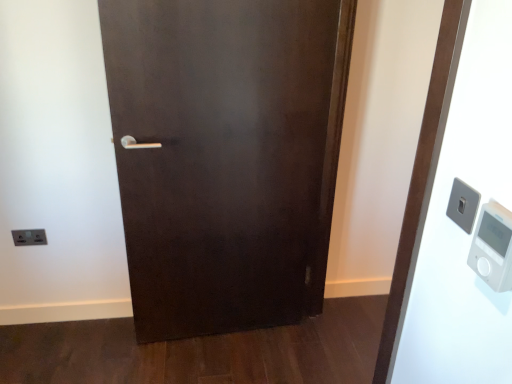
Question: From the image's perspective, is white plastic elevator at right positioned above or below satin silver switch at upper right, acting as the 1th light switch starting from the front?

Choices:
 (A) below
 (B) above

Answer: (A)

Question: Considering the positions of white plastic elevator at right and satin silver switch at upper right, the second light switch viewed from the back, in the image, is white plastic elevator at right taller or shorter than satin silver switch at upper right, the second light switch viewed from the back,?

Choices:
 (A) tall
 (B) short

Answer: (A)

Question: Which of these objects is positioned farthest from the satin silver switch at upper right, the second light switch viewed from the back?

Choices:
 (A) satin silver switch at lower left, the 2th light switch from the right
 (B) white plastic elevator at right
 (C) white plastic thermometer at right

Answer: (A)

Question: Estimate the real-world distances between objects in this image. Which object is farther from the white plastic thermometer at right?

Choices:
 (A) satin silver switch at upper right, the first light switch from the right
 (B) white plastic elevator at right
 (C) satin silver switch at lower left, positioned as the first light switch in back-to-front order

Answer: (C)